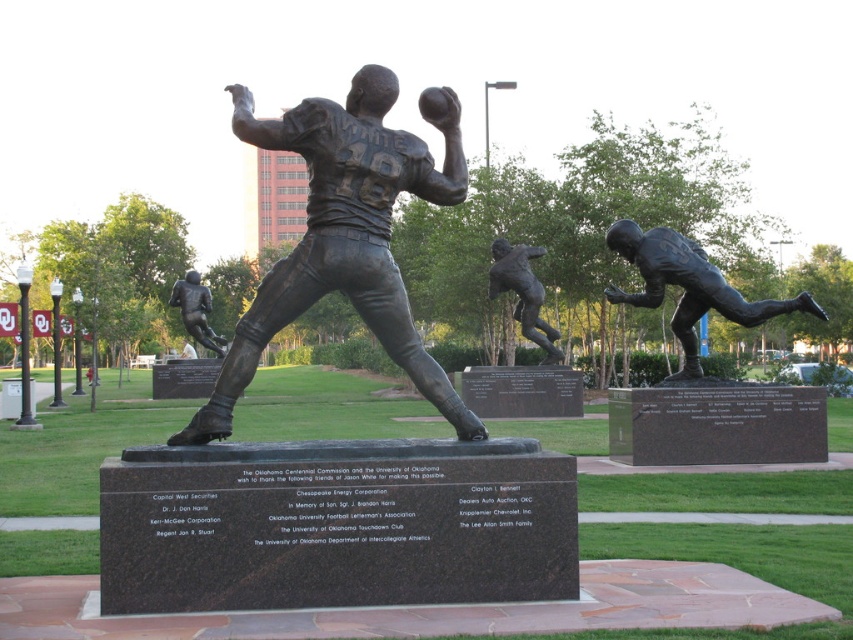
Does bronze/statue at center have a smaller size compared to bronze statue of a football player at center?

Yes.

Between point (305, 115) and point (193, 336), which one is positioned behind?

Point (193, 336)

You are a GUI agent. You are given a task and a screenshot of the screen. Output one action in this format:
    pyautogui.click(x=<x>, y=<y>)
    Task: Click on the bronze/statue at center
    This screenshot has width=853, height=640.
    Given the screenshot: What is the action you would take?
    pyautogui.click(x=343, y=236)

Between bronze/statue at center and bronze statue at right, which one appears on the right side from the viewer's perspective?

bronze statue at right

This screenshot has height=640, width=853. What do you see at coordinates (343, 236) in the screenshot? I see `bronze/statue at center` at bounding box center [343, 236].

Where is `bronze/statue at center`? The width and height of the screenshot is (853, 640). bronze/statue at center is located at coordinates (343, 236).

Does point (688, 268) lie in front of point (204, 321)?

Yes.

Between point (744, 324) and point (212, 330), which one is positioned behind?

The point (212, 330) is more distant.

This screenshot has width=853, height=640. What are the coordinates of `bronze statue at right` in the screenshot? It's located at (688, 285).

At what (x,y) coordinates should I click in order to perform the action: click on bronze statue at right. Please return your answer as a coordinate pair (x, y). Looking at the image, I should click on (688, 285).